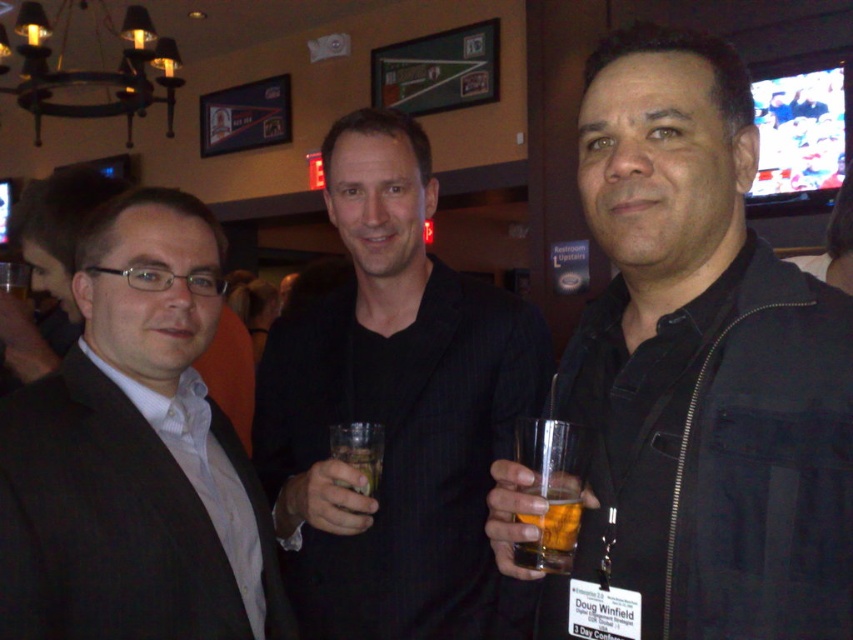
Does black pinstripe suit at center have a lesser height compared to clear glass at center?

No.

Can you confirm if black pinstripe suit at center is thinner than clear glass at center?

No, black pinstripe suit at center is not thinner than clear glass at center.

You are a GUI agent. You are given a task and a screenshot of the screen. Output one action in this format:
    pyautogui.click(x=<x>, y=<y>)
    Task: Click on the black pinstripe suit at center
    Image resolution: width=853 pixels, height=640 pixels.
    Given the screenshot: What is the action you would take?
    pyautogui.click(x=395, y=412)

Does translucent glass at right have a lesser height compared to clear glass at center?

Correct, translucent glass at right is not as tall as clear glass at center.

Looking at this image, measure the distance between point (515, 545) and camera.

A distance of 78.10 centimeters exists between point (515, 545) and camera.

Which is behind, point (561, 499) or point (374, 433)?

The point (374, 433) is behind.

Where is `translucent glass at right`? translucent glass at right is located at coordinates (550, 525).

Based on the photo, between matte black suit at left and clear glass at center, which one is positioned higher?

matte black suit at left

Between matte black suit at left and clear glass at center, which one has less height?

Standing shorter between the two is clear glass at center.

Describe the element at coordinates (135, 452) in the screenshot. This screenshot has width=853, height=640. I see `matte black suit at left` at that location.

The width and height of the screenshot is (853, 640). Identify the location of matte black suit at left. (135, 452).